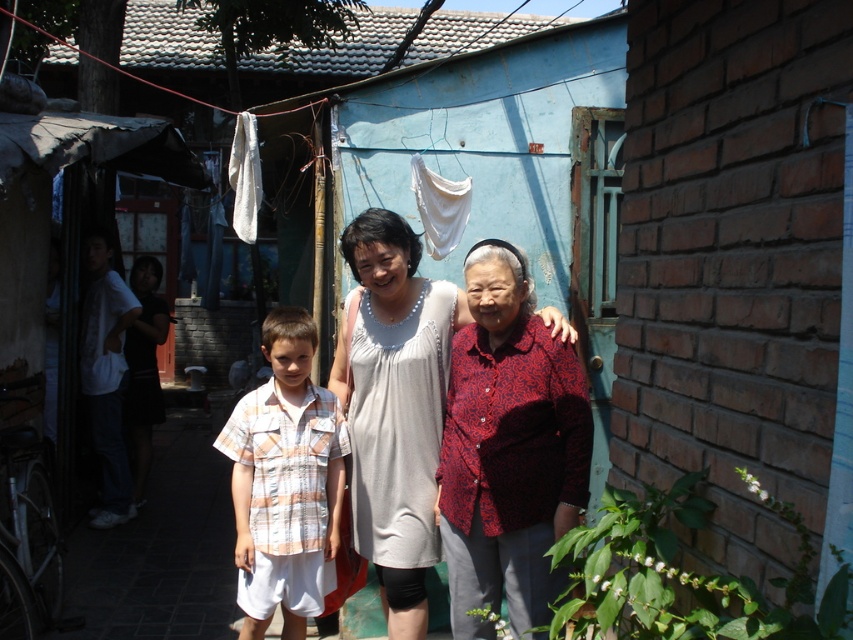
You are standing in the residential area scene. You need to locate the red patterned blouse. Where exactly is it located in relation to the point marked at coordinates (508, 449)?

The red patterned blouse at center is exactly at the point marked at coordinates (508, 449).

You are standing in the residential area and want to find the red patterned blouse at center. Based on the coordinates provided, can you determine if it is positioned to the left or right of the center point of the image?

The red patterned blouse at center is located at point [508,449]. Since the x coordinate is 0.703 which is greater than 0.5, it is positioned to the right of the center point of the image.